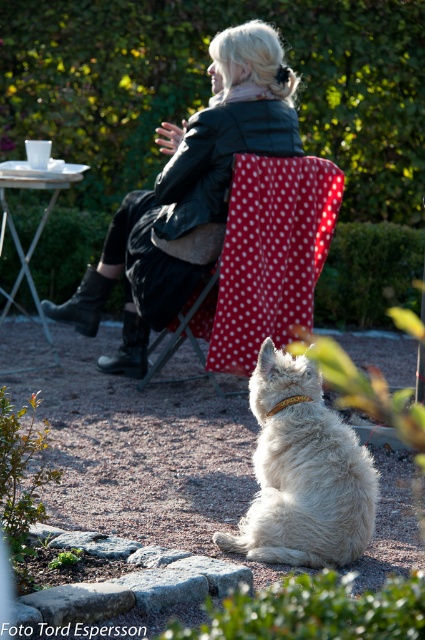
You are a photographer adjusting your camera settings to capture the woman in the scene. You notice the leather jacket at center and the matte black neckband at upper center. Which object should you focus on first if you want to ensure both are in sharp focus, considering their positions?

The leather jacket at center is located below the matte black neckband at upper center. To ensure both are in sharp focus, focus on the matte black neckband at upper center first since it is farther away, allowing the depth of field to cover the leather jacket below.